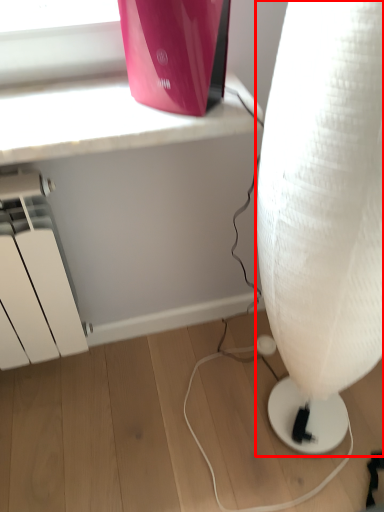
Question: From the image's perspective, where is lamp (annotated by the red box) located relative to appliance?

Choices:
 (A) above
 (B) below

Answer: (B)